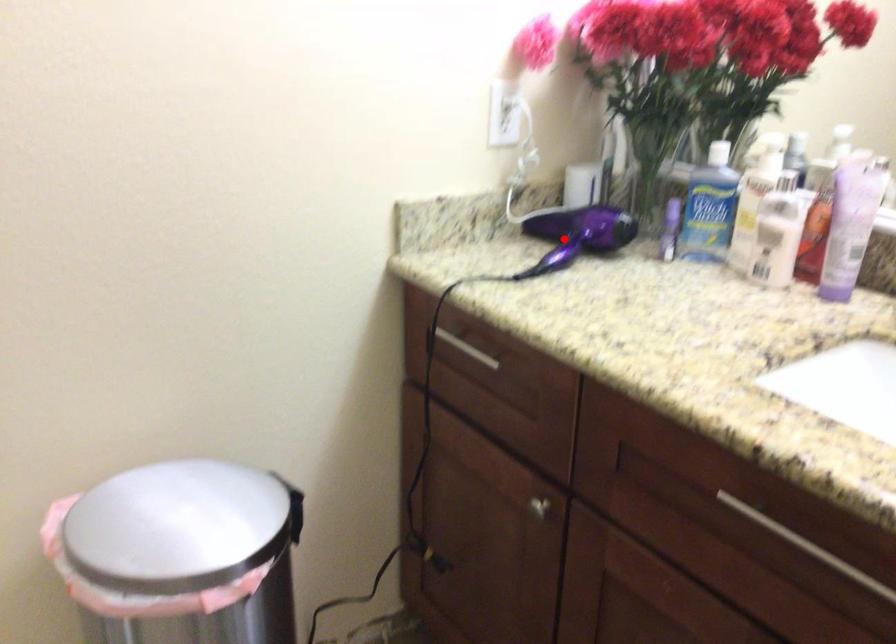
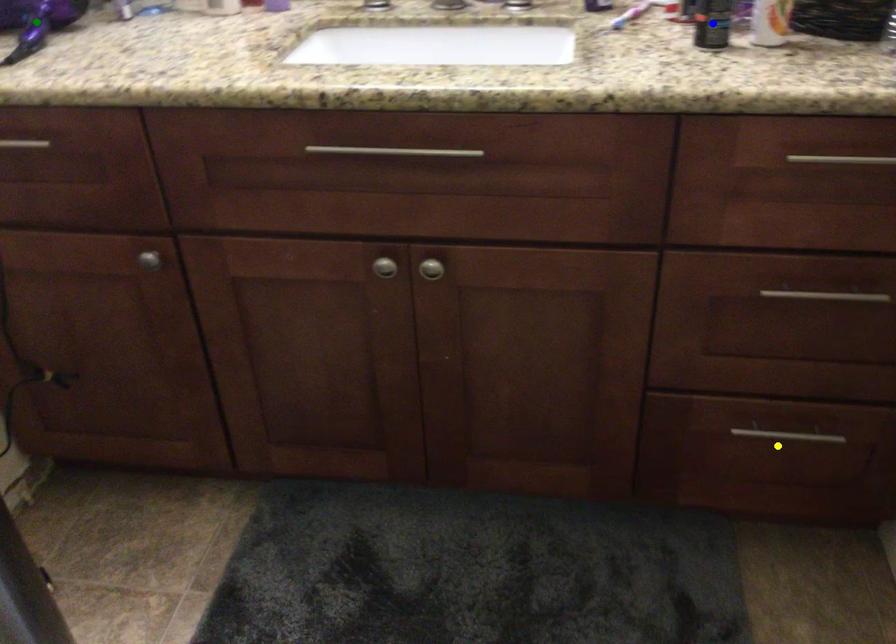
Question: I am providing you with two images of the same scene from different viewpoints. A red point is marked on the first image. You are given multiple points on the second image. Which point in image 2 is actually the same real-world point as the red point in image 1?

Choices:
 (A) yellow point
 (B) green point
 (C) blue point

Answer: (B)